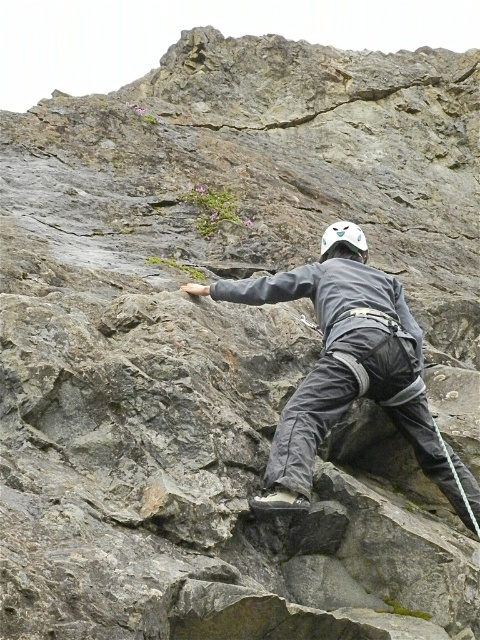
Is gray fabric helmet at center above white matte helmet at center?

No, gray fabric helmet at center is not above white matte helmet at center.

Between gray fabric helmet at center and white matte helmet at center, which one has less height?

white matte helmet at center

Image resolution: width=480 pixels, height=640 pixels. I want to click on gray fabric helmet at center, so click(349, 376).